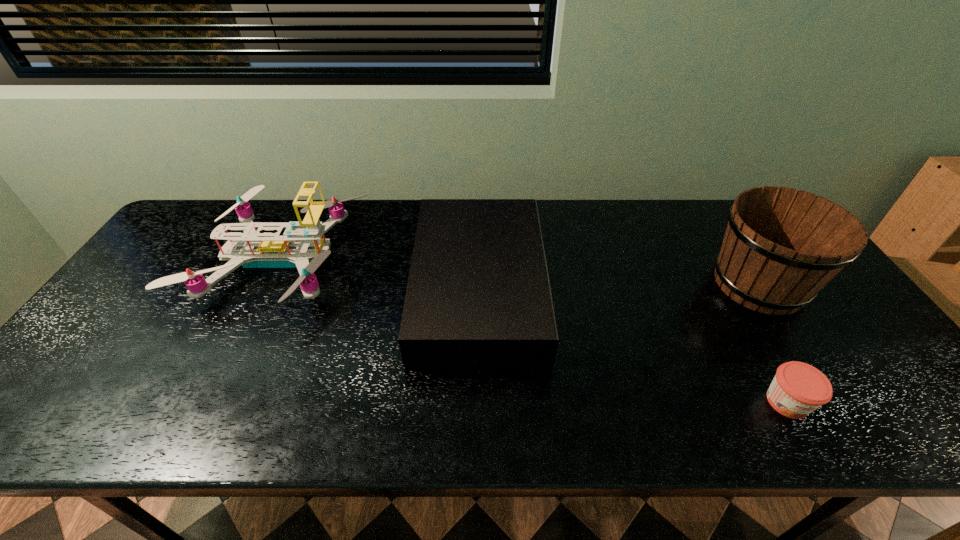
The height and width of the screenshot is (540, 960). Identify the location of empty space that is in between the CD player and the wine bucket. (619, 286).

Find the location of a particular element. vacant area that lies between the wine bucket and the jam is located at coordinates (773, 343).

Where is `vacant area that lies between the shortest object and the second object from left to right`? This screenshot has width=960, height=540. vacant area that lies between the shortest object and the second object from left to right is located at coordinates (633, 345).

Find the location of a particular element. the second closest object to the leftmost object is located at coordinates (782, 246).

Locate an element on the screen. This screenshot has width=960, height=540. object that ranks as the second closest to the nearest object is located at coordinates (478, 294).

Locate an element on the screen. The image size is (960, 540). free spot that satisfies the following two spatial constraints: 1. on the front side of the wine bucket; 2. at the front of the third tallest object for disc insertion is located at coordinates (761, 287).

Locate an element on the screen. vacant space that satisfies the following two spatial constraints: 1. on the front-facing side of the wine bucket; 2. on the left side of the leftmost object is located at coordinates (270, 284).

This screenshot has height=540, width=960. Find the location of `vacant area in the image that satisfies the following two spatial constraints: 1. on the front-facing side of the wine bucket; 2. on the right side of the drone`. vacant area in the image that satisfies the following two spatial constraints: 1. on the front-facing side of the wine bucket; 2. on the right side of the drone is located at coordinates (270, 284).